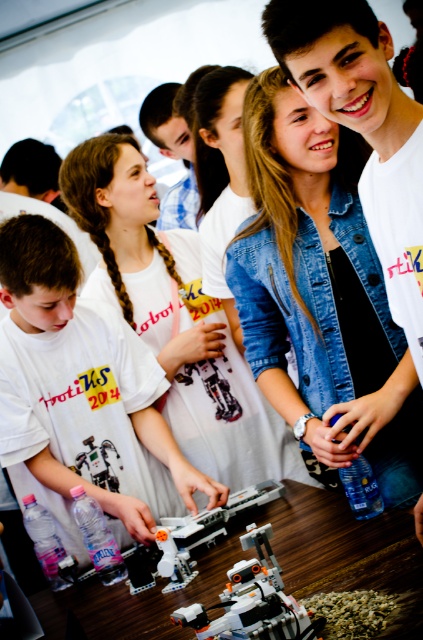
You are a participant in the robotics competition and need to retrieve your robot. Your robot is the one that is positioned above the other robot. Which robot should you choose between the white plastic robot at center and the translucent plastic robot at center?

You should choose the translucent plastic robot at center because it is positioned above the white plastic robot at center.